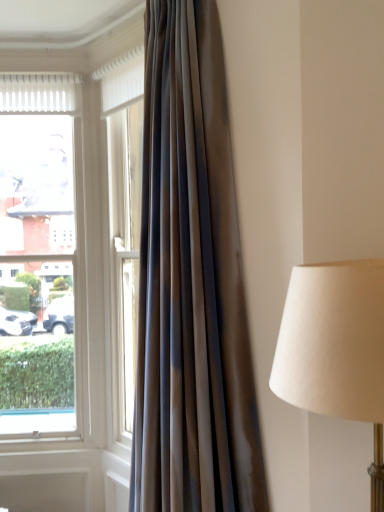
This screenshot has height=512, width=384. In order to click on satin-like brown curtain at left in this screenshot , I will do `click(191, 283)`.

Describe the element at coordinates (191, 283) in the screenshot. I see `satin-like brown curtain at left` at that location.

Describe the element at coordinates (37, 250) in the screenshot. I see `clear glass window at left` at that location.

Where is `clear glass window at left`? clear glass window at left is located at coordinates (37, 250).

Locate an element on the screen. The width and height of the screenshot is (384, 512). satin-like brown curtain at left is located at coordinates (191, 283).

Is clear glass window at left to the left or to the right of satin-like brown curtain at left in the image?

clear glass window at left is to the left of satin-like brown curtain at left.

Which object is more forward, clear glass window at left or satin-like brown curtain at left?

satin-like brown curtain at left is closer to the camera.

Which is behind, point (4, 326) or point (180, 352)?

The point (4, 326) is farther from the camera.

From the image's perspective, is clear glass window at left located above satin-like brown curtain at left?

No, from the image's perspective, clear glass window at left is not over satin-like brown curtain at left.

From a real-world perspective, which object rests below the other?

From a 3D spatial view, clear glass window at left is below.

Considering the sizes of clear glass window at left and satin-like brown curtain at left in the image, is clear glass window at left wider or thinner than satin-like brown curtain at left?

Clearly, clear glass window at left has less width compared to satin-like brown curtain at left.

Does clear glass window at left have a greater height compared to satin-like brown curtain at left?

Incorrect, the height of clear glass window at left is not larger of that of satin-like brown curtain at left.

Considering the relative sizes of clear glass window at left and satin-like brown curtain at left in the image provided, is clear glass window at left bigger than satin-like brown curtain at left?

No.

Is satin-like brown curtain at left completely or partially inside clear glass window at left?

No, satin-like brown curtain at left is not surrounded by clear glass window at left.

Are clear glass window at left and satin-like brown curtain at left beside each other?

No, clear glass window at left is not in contact with satin-like brown curtain at left.

Is satin-like brown curtain at left at the back of clear glass window at left?

No, clear glass window at left's orientation is not away from satin-like brown curtain at left.

I want to click on curtain on the right of clear glass window at left, so click(191, 283).

Considering the positions of objects satin-like brown curtain at left and clear glass window at left in the image provided, who is more to the right, satin-like brown curtain at left or clear glass window at left?

Positioned to the right is satin-like brown curtain at left.

Does satin-like brown curtain at left come in front of clear glass window at left?

Yes, it is.

Which point is more forward, [219,22] or [55,342]?

The point [219,22] is in front.

From the image's perspective, is satin-like brown curtain at left over clear glass window at left?

Indeed, from the image's perspective, satin-like brown curtain at left is shown above clear glass window at left.

From a real-world perspective, which is physically below, satin-like brown curtain at left or clear glass window at left?

From a 3D spatial view, clear glass window at left is below.

Consider the image. Between satin-like brown curtain at left and clear glass window at left, which one has smaller width?

Thinner between the two is clear glass window at left.

Which of these two, satin-like brown curtain at left or clear glass window at left, stands taller?

satin-like brown curtain at left.

Considering the relative sizes of satin-like brown curtain at left and clear glass window at left in the image provided, is satin-like brown curtain at left bigger than clear glass window at left?

Yes.

Looking at this image, would you say satin-like brown curtain at left is outside clear glass window at left?

Yes, satin-like brown curtain at left is outside of clear glass window at left.

Is satin-like brown curtain at left placed right next to clear glass window at left?

satin-like brown curtain at left and clear glass window at left are clearly separated.

From the picture: Is satin-like brown curtain at left facing away from clear glass window at left?

No, satin-like brown curtain at left's orientation is not away from clear glass window at left.

Where is `window beneath the satin-like brown curtain at left (from a real-world perspective)`? window beneath the satin-like brown curtain at left (from a real-world perspective) is located at coordinates (37, 250).

Identify the location of window beneath the satin-like brown curtain at left (from a real-world perspective). Image resolution: width=384 pixels, height=512 pixels. (37, 250).

At what (x,y) coordinates should I click in order to perform the action: click on curtain above the clear glass window at left (from a real-world perspective). Please return your answer as a coordinate pair (x, y). Looking at the image, I should click on (191, 283).